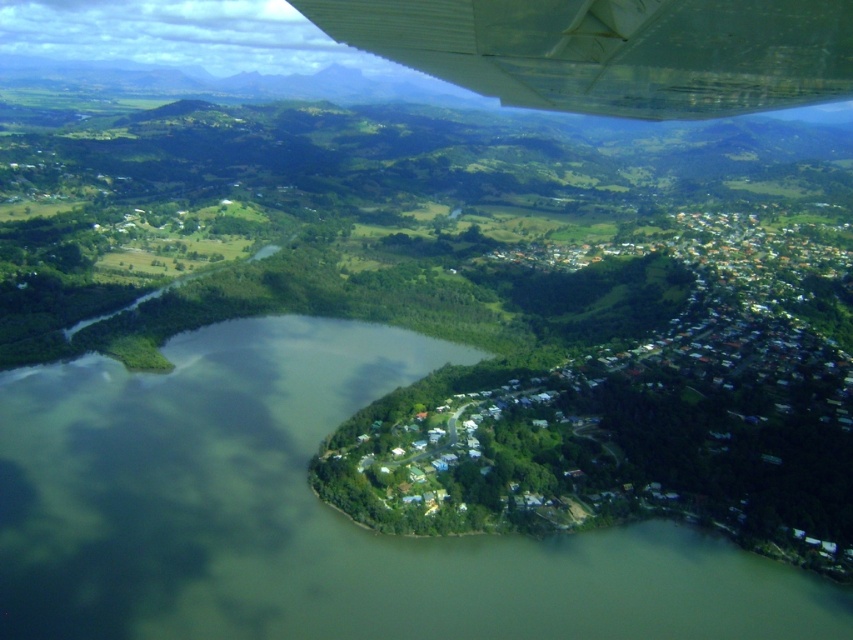
Does green water at center come in front of white metallic wing at upper center?

No, it is behind white metallic wing at upper center.

Measure the distance from green water at center to white metallic wing at upper center.

A distance of 155.17 meters exists between green water at center and white metallic wing at upper center.

This screenshot has height=640, width=853. What are the coordinates of `green water at center` in the screenshot? It's located at (314, 515).